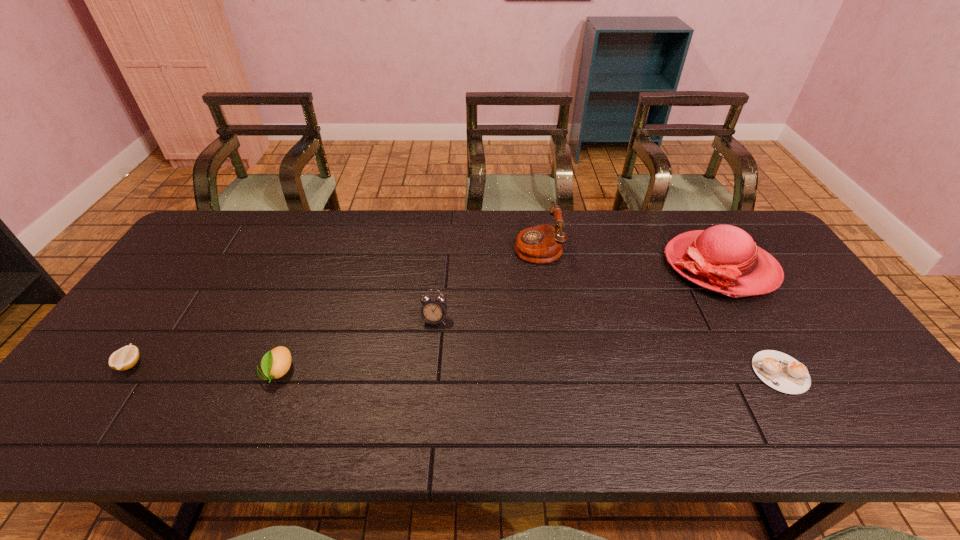
You are a GUI agent. You are given a task and a screenshot of the screen. Output one action in this format:
    pyautogui.click(x=<x>, y=<y>)
    Task: Click on the hat that is at the far edge
    The width and height of the screenshot is (960, 540).
    Given the screenshot: What is the action you would take?
    pyautogui.click(x=723, y=258)

Image resolution: width=960 pixels, height=540 pixels. What are the coordinates of `object at the left edge` in the screenshot? It's located at (126, 357).

In order to click on hat that is at the right edge in this screenshot , I will do `click(723, 258)`.

Where is `cappuccino positioned at the right edge`? This screenshot has width=960, height=540. cappuccino positioned at the right edge is located at coordinates (778, 370).

Where is `object that is at the far right corner`? This screenshot has height=540, width=960. object that is at the far right corner is located at coordinates point(723,258).

I want to click on vacant point at the far edge, so click(x=318, y=247).

Locate an element on the screen. vacant space at the near edge is located at coordinates (614, 424).

I want to click on free region at the left edge of the desktop, so click(170, 328).

Image resolution: width=960 pixels, height=540 pixels. In the image, there is a desktop. In order to click on vacant space at the near left corner in this screenshot , I will do `click(60, 418)`.

Locate an element on the screen. The width and height of the screenshot is (960, 540). blank region between the hat and the fourth object from right to left is located at coordinates (577, 293).